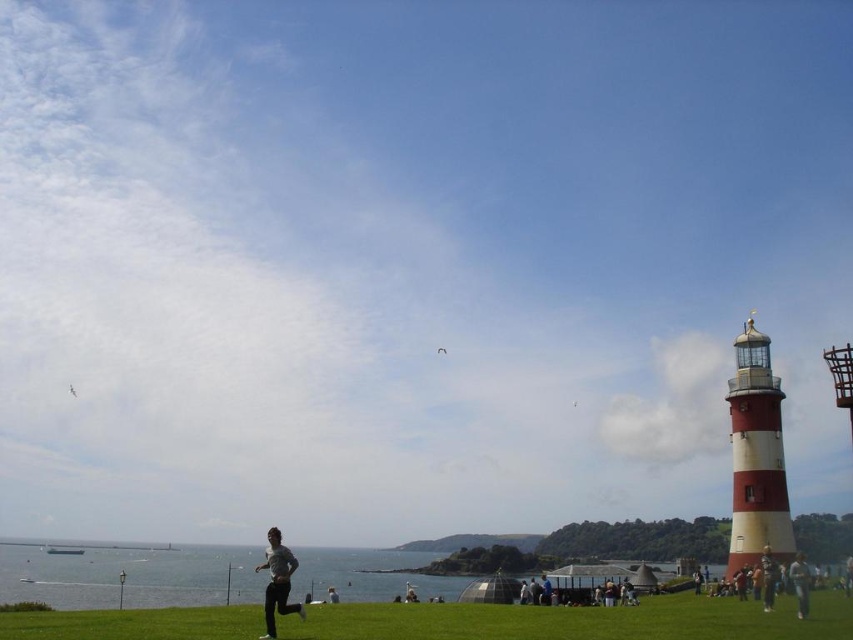
You are standing at the lighthouse on the right side of the image. You want to greet the person wearing the gray cotton shirt at center. In which direction should you walk to reach them?

The gray cotton shirt at center is located at point 0.909 on the x axis and 0.326 on the y axis. Since the lighthouse is on the right side of the image, you should walk towards the left to reach the gray cotton shirt at center.

You are a photographer positioned at the lighthouse on the right. You want to capture a photo that includes both the gray cotton shirt at center and the white matte kite at upper center without any obstructions. Based on their positions, which object should you adjust your camera angle to focus on first to ensure both are in frame?

The gray cotton shirt at center is to the right of the white matte kite at upper center. To include both in the frame, you should first focus on the white matte kite at upper center since it is positioned higher and to the left, allowing the shirt to be captured in the same shot by adjusting the angle slightly to the right.

You are a photographer planning to take a picture of the lighthouse. You notice a gray cotton shirt at center located at point (277, 580). Would positioning your camera at this point allow you to capture the lighthouse in the background with the gray cotton shirt at center as the foreground subject?

Yes, positioning the camera at point (277, 580) would place the gray cotton shirt at center in the foreground while the lighthouse remains visible in the background, as the description specifies the shirt is located at that point.